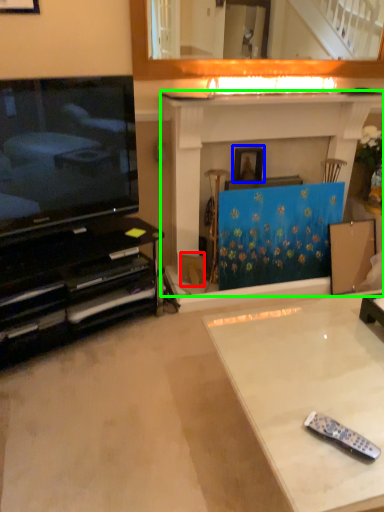
Question: Which object is positioned farthest from cardboard box (highlighted by a red box)? Select from picture frame (highlighted by a blue box) and fireplace (highlighted by a green box).

Choices:
 (A) picture frame
 (B) fireplace

Answer: (B)